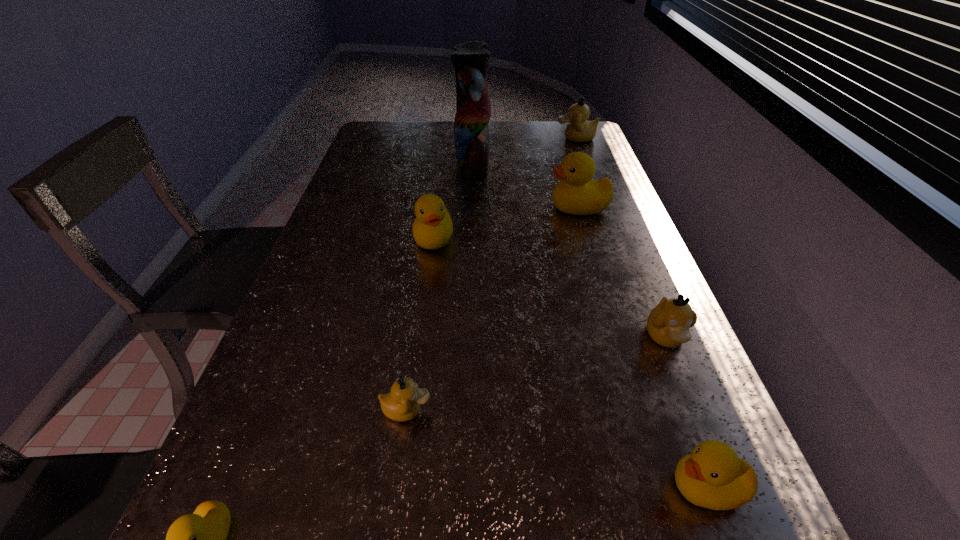
The width and height of the screenshot is (960, 540). In order to click on vacant space that satisfies the following two spatial constraints: 1. on the face of the biggest yellow duckling; 2. on the face of the third nearest yellow duckling in this screenshot , I will do `click(588, 239)`.

Where is `vacant point that satisfies the following two spatial constraints: 1. on the face of the farthest duckling; 2. on the face of the fourth farthest object`? vacant point that satisfies the following two spatial constraints: 1. on the face of the farthest duckling; 2. on the face of the fourth farthest object is located at coordinates (612, 239).